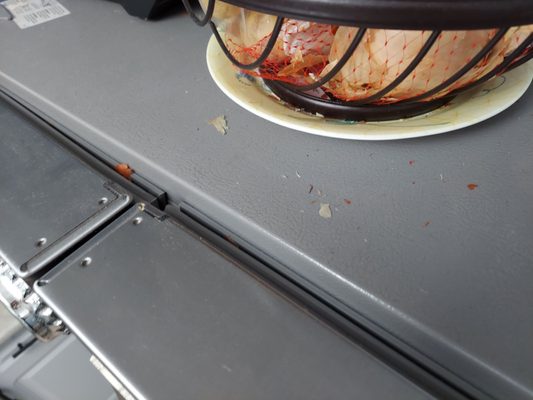
You are a GUI agent. You are given a task and a screenshot of the screen. Output one action in this format:
    pyautogui.click(x=<x>, y=<y>)
    Task: Click on the brown basket
    This screenshot has height=400, width=533.
    Given the screenshot: What is the action you would take?
    (331, 102)